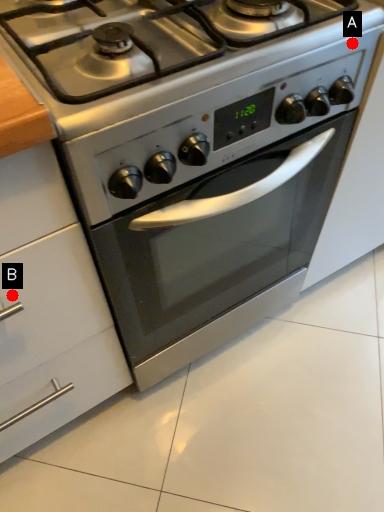
Question: Two points are circled on the image, labeled by A and B beside each circle. Which point is farther to the camera?

Choices:
 (A) A is further
 (B) B is further

Answer: (A)